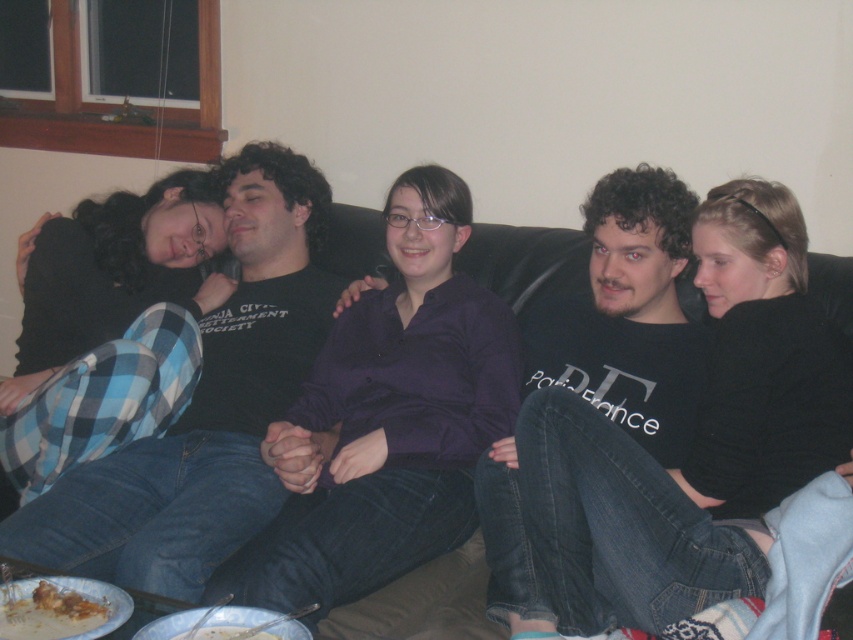
You are a photographer setting up for a group photo. You notice the black cotton shirt at left and the brown crumbly food at lower left. Which object is positioned higher in the image?

The black cotton shirt at left is above brown crumbly food at lower left, so the black cotton shirt at left is positioned higher in the image.